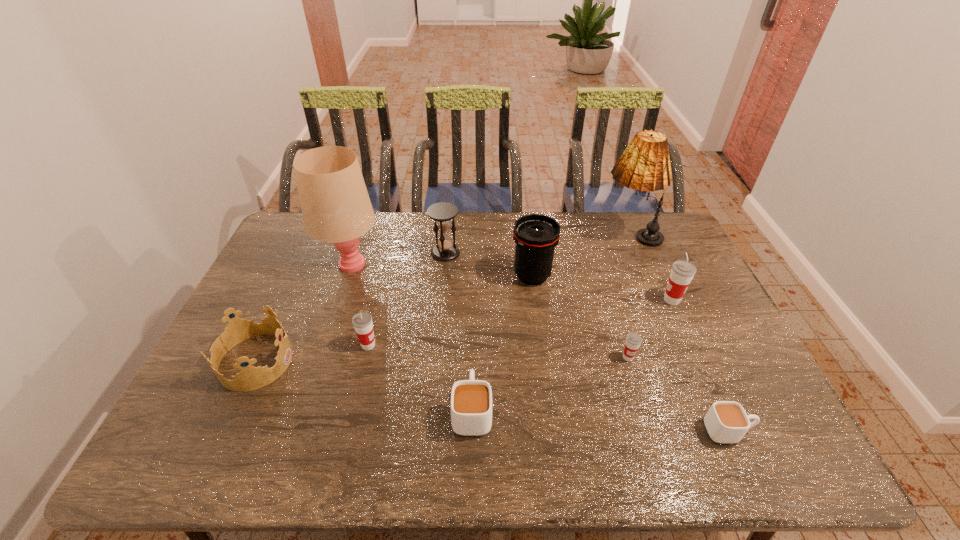
This screenshot has width=960, height=540. What are the coordinates of `free space between the telephoto lens and the rightmost red cup` in the screenshot? It's located at point(602,288).

Image resolution: width=960 pixels, height=540 pixels. What are the coordinates of `free space that is in between the second biggest red cup and the fourth object from left to right` in the screenshot? It's located at (407, 299).

I want to click on the second closest object relative to the fourth object from left to right, so click(536, 236).

This screenshot has width=960, height=540. What are the coordinates of `object that ranks as the ninth closest to the right lampshade` in the screenshot? It's located at (250, 378).

Identify which cup is located as the fourth nearest to the sixth nearest object. Please provide its 2D coordinates. Your answer should be formatted as a tuple, i.e. [(x, y)], where the tuple contains the x and y coordinates of a point satisfying the conditions above.

[(362, 322)]

Identify which cup is the fourth nearest to the right lampshade. Please provide its 2D coordinates. Your answer should be formatted as a tuple, i.e. [(x, y)], where the tuple contains the x and y coordinates of a point satisfying the conditions above.

[(471, 400)]

The image size is (960, 540). What are the coordinates of `red cup object that ranks as the second closest to the bigger white cup` in the screenshot? It's located at (633, 340).

Identify which red cup is the closest to the fourth object from right to left. Please provide its 2D coordinates. Your answer should be formatted as a tuple, i.e. [(x, y)], where the tuple contains the x and y coordinates of a point satisfying the conditions above.

[(682, 272)]

This screenshot has width=960, height=540. Identify the location of free location that satisfies the following two spatial constraints: 1. on the back side of the pink lampshade; 2. on the right side of the black hourglass. (355, 253).

At what (x,y) coordinates should I click in order to perform the action: click on vacant space that satisfies the following two spatial constraints: 1. on the front-facing side of the right lampshade; 2. on the side of the second red cup from left to right with the logo. Please return your answer as a coordinate pair (x, y). This screenshot has height=540, width=960. Looking at the image, I should click on (681, 357).